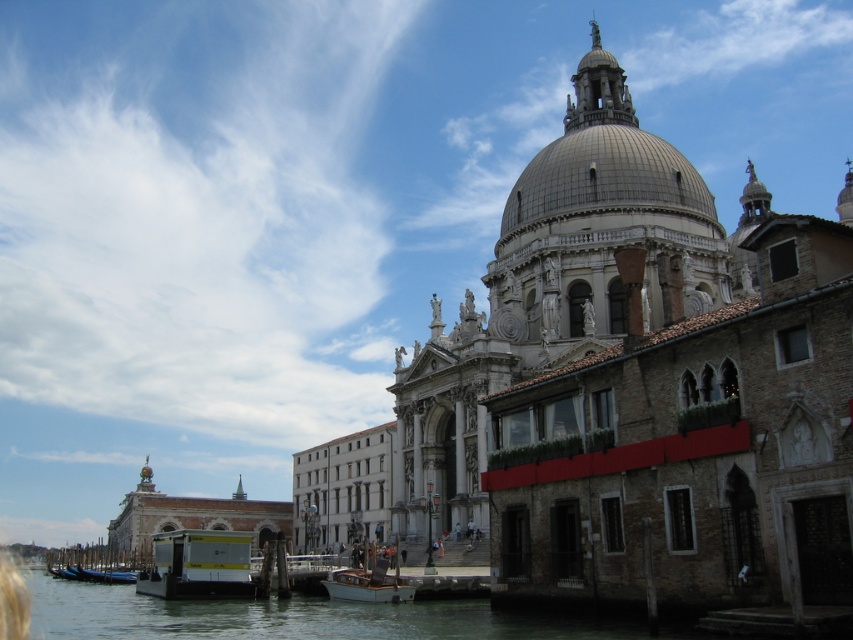
Does clear water at lower left have a lesser height compared to wooden polished boat at lower center?

No, clear water at lower left is not shorter than wooden polished boat at lower center.

Image resolution: width=853 pixels, height=640 pixels. In order to click on clear water at lower left in this screenshot , I will do `click(285, 616)`.

The image size is (853, 640). Identify the location of clear water at lower left. (285, 616).

You are a GUI agent. You are given a task and a screenshot of the screen. Output one action in this format:
    pyautogui.click(x=<x>, y=<y>)
    Task: Click on the clear water at lower left
    The height and width of the screenshot is (640, 853).
    Given the screenshot: What is the action you would take?
    pyautogui.click(x=285, y=616)

Who is more distant from viewer, (444, 616) or (222, 564)?

The point (222, 564) is more distant.

I want to click on clear water at lower left, so click(285, 616).

Is point (590, 634) more distant than point (604, 160)?

No, it is in front of (604, 160).

Who is shorter, clear water at lower left or gray stone dome at center?

clear water at lower left

Identify the location of clear water at lower left. (285, 616).